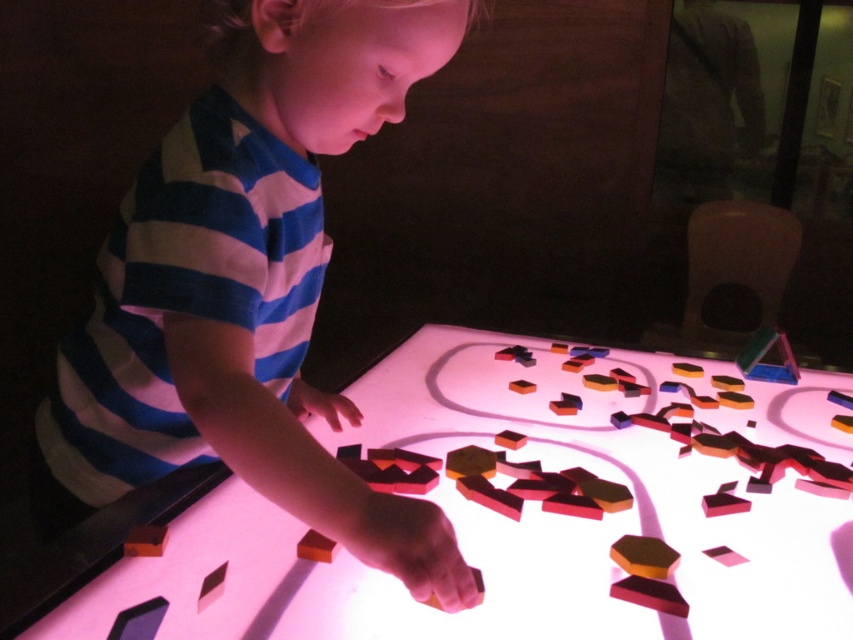
Between translucent plastic table at center and rubberized plastic block at lower left, which one has more height?

translucent plastic table at center is taller.

Does translucent plastic table at center appear on the right side of rubberized plastic block at lower left?

Yes, translucent plastic table at center is to the right of rubberized plastic block at lower left.

Is point (566, 593) more distant than point (155, 529)?

No, (566, 593) is closer to viewer.

You are a GUI agent. You are given a task and a screenshot of the screen. Output one action in this format:
    pyautogui.click(x=<x>, y=<y>)
    Task: Click on the translucent plastic table at center
    
    Given the screenshot: What is the action you would take?
    pyautogui.click(x=514, y=512)

Between translucent plastic triangle at upper right and rubberized plastic block at lower left, which one is positioned lower?

rubberized plastic block at lower left is lower down.

Where is `translucent plastic triangle at upper right`? Image resolution: width=853 pixels, height=640 pixels. translucent plastic triangle at upper right is located at coordinates (767, 356).

Can you confirm if blue striped shirt at upper left is shorter than rubber cube at lower center?

Incorrect, blue striped shirt at upper left's height does not fall short of rubber cube at lower center's.

Based on the photo, does blue striped shirt at upper left have a lesser width compared to rubber cube at lower center?

No, blue striped shirt at upper left is not thinner than rubber cube at lower center.

Is point (283, 285) in front of point (316, 557)?

No, it is not.

Identify the location of blue striped shirt at upper left. The image size is (853, 640). (247, 288).